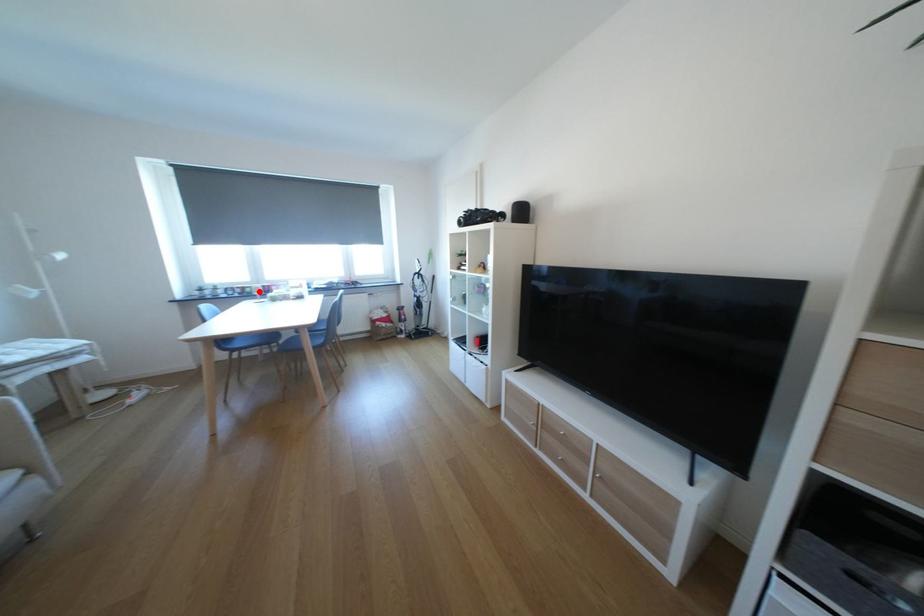
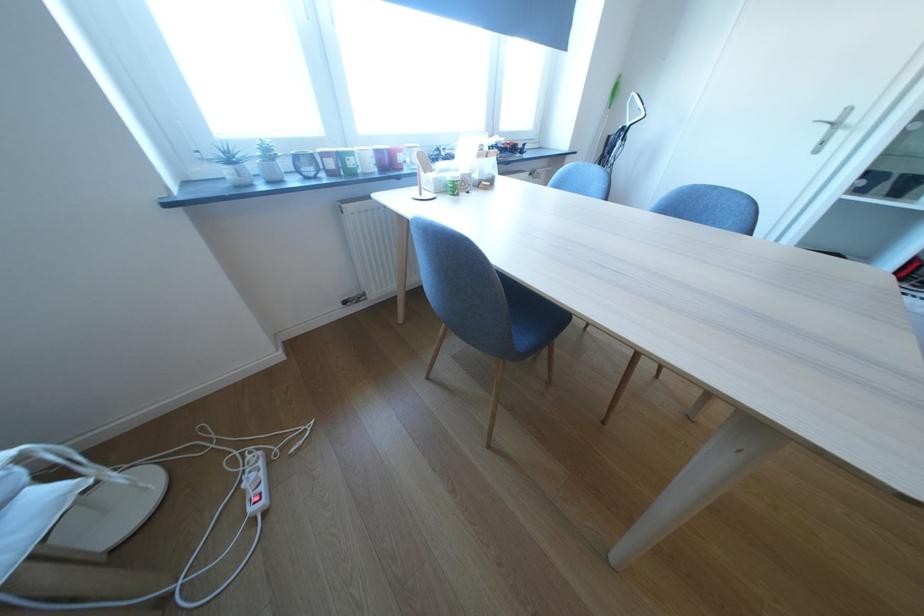
In the second image, find the point that corresponds to the highlighted location in the first image.

(361, 164)